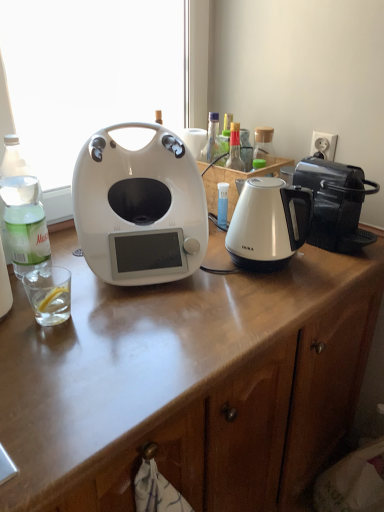
Looking at this image, measure the distance between white glossy coffee maker at center and camera.

white glossy coffee maker at center and camera are 96.83 centimeters apart.

In order to face clear glass bottle at left, should I rotate leftwards or rightwards?

Turn left approximately 21.848 degrees to face it.

The width and height of the screenshot is (384, 512). Describe the element at coordinates (324, 145) in the screenshot. I see `white plastic power outlet at upper right` at that location.

Image resolution: width=384 pixels, height=512 pixels. Find the location of `clear glass at left`. clear glass at left is located at coordinates (49, 294).

The width and height of the screenshot is (384, 512). I want to click on white glossy coffee maker at center, so click(139, 208).

How many degrees apart are the facing directions of clear glass bottle at left and clear glass at left?

clear glass bottle at left and clear glass at left are facing 0.396 degrees away from each other.

Locate an element on the screen. bottle above the clear glass at left (from the image's perspective) is located at coordinates (23, 211).

Is clear glass bottle at left not within clear glass at left?

Yes, clear glass bottle at left is not within clear glass at left.

Considering the relative positions of clear glass bottle at left and clear glass at left in the image provided, is clear glass bottle at left to the left of clear glass at left from the viewer's perspective?

Yes, clear glass bottle at left is to the left of clear glass at left.

From a real-world perspective, is black plastic toaster at right over white glossy kettle at center-right?

Yes.

Is black plastic toaster at right taller or shorter than white glossy kettle at center-right?

Considering their sizes, black plastic toaster at right has less height than white glossy kettle at center-right.

In the image, is black plastic toaster at right positioned in front of or behind white glossy kettle at center-right?

Visually, black plastic toaster at right is located behind white glossy kettle at center-right.

From a real-world perspective, is white glossy kettle at center-right physically below black plastic toaster at right?

Yes, from a real-world perspective, white glossy kettle at center-right is below black plastic toaster at right.

How many degrees apart are the facing directions of white glossy kettle at center-right and black plastic toaster at right?

white glossy kettle at center-right and black plastic toaster at right are facing 2.68 degrees away from each other.

Can you confirm if white glossy kettle at center-right is thinner than black plastic toaster at right?

Yes.

Is black plastic toaster at right inside white glossy kettle at center-right?

Definitely not — black plastic toaster at right is not inside white glossy kettle at center-right.

Based on the photo, between white glossy coffee maker at center and white plastic power outlet at upper right, which one is positioned behind?

Positioned behind is white plastic power outlet at upper right.

Looking at this image, is white glossy coffee maker at center smaller than white plastic power outlet at upper right?

No, white glossy coffee maker at center is not smaller than white plastic power outlet at upper right.

From a real-world perspective, which object rests below the other?

white glossy coffee maker at center, from a real-world perspective.

Between white glossy coffee maker at center and white plastic power outlet at upper right, which one has smaller width?

Thinner between the two is white plastic power outlet at upper right.

Does white glossy coffee maker at center appear on the right side of black plastic toaster at right?

Incorrect, white glossy coffee maker at center is not on the right side of black plastic toaster at right.

From a real-world perspective, which object stands above the other?

white glossy coffee maker at center.

Considering the points (138, 197) and (350, 210), which point is behind, point (138, 197) or point (350, 210)?

The point (350, 210) is farther from the camera.

From the image's perspective, which one is positioned lower, clear glass at left or black plastic toaster at right?

clear glass at left.

Is clear glass at left facing away from black plastic toaster at right?

No.

Find the location of a particular element. The height and width of the screenshot is (512, 384). toaster that is above the clear glass at left (from the image's perspective) is located at coordinates (335, 203).

Based on the photo, which object is closer to the camera taking this photo, clear glass at left or black plastic toaster at right?

clear glass at left is in front.

Is black plastic toaster at right positioned with its back to white glossy window screen at center?

Correct, black plastic toaster at right is looking away from white glossy window screen at center.

Considering the sizes of black plastic toaster at right and white glossy window screen at center in the image, is black plastic toaster at right wider or thinner than white glossy window screen at center?

In the image, black plastic toaster at right appears to be wider than white glossy window screen at center.

Which point is more forward, [320,216] or [166,11]?

The point [320,216] is in front.

Is black plastic toaster at right taller or shorter than white glossy window screen at center?

In the image, black plastic toaster at right appears to be shorter than white glossy window screen at center.

Locate an element on the screen. The width and height of the screenshot is (384, 512). bottle that is behind the clear glass at left is located at coordinates (23, 211).

Find the location of a particular element. This screenshot has height=512, width=384. kettle in front of the black plastic toaster at right is located at coordinates (268, 223).

Based on their spatial positions, is clear glass bottle at left or black plastic toaster at right further from white glossy window screen at center?

black plastic toaster at right.

Estimate the real-world distances between objects in this image. Which object is closer to white plastic power outlet at upper right, white glossy coffee maker at center or white glossy kettle at center-right?

Based on the image, white glossy kettle at center-right appears to be nearer to white plastic power outlet at upper right.

Looking at the image, which one is located closer to clear glass at left, white glossy coffee maker at center or white glossy kettle at center-right?

Based on the image, white glossy coffee maker at center appears to be nearer to clear glass at left.

Considering their positions, is clear glass at left positioned further to white plastic power outlet at upper right than clear glass bottle at left?

The object further to white plastic power outlet at upper right is clear glass at left.

Estimate the real-world distances between objects in this image. Which object is closer to white glossy coffee maker at center, black plastic toaster at right or white glossy kettle at center-right?

The object closer to white glossy coffee maker at center is white glossy kettle at center-right.

Estimate the real-world distances between objects in this image. Which object is closer to clear glass bottle at left, white plastic power outlet at upper right or black plastic toaster at right?

black plastic toaster at right is closer to clear glass bottle at left.

Looking at the image, which one is located closer to white glossy kettle at center-right, black plastic toaster at right or white glossy coffee maker at center?

black plastic toaster at right lies closer to white glossy kettle at center-right than the other object.

Based on their spatial positions, is white plastic power outlet at upper right or clear glass at left closer to white glossy kettle at center-right?

The object closer to white glossy kettle at center-right is white plastic power outlet at upper right.

Locate an element on the screen. This screenshot has width=384, height=512. window screen situated between clear glass bottle at left and white plastic power outlet at upper right from left to right is located at coordinates (88, 72).

Locate an element on the screen. kitchen appliance situated between clear glass at left and black plastic toaster at right from left to right is located at coordinates (139, 208).

What are the coordinates of `kitchen appliance between white glossy window screen at center and white glossy kettle at center-right from left to right` in the screenshot? It's located at (139, 208).

Locate an element on the screen. kettle between white glossy window screen at center and black plastic toaster at right in the horizontal direction is located at coordinates (268, 223).